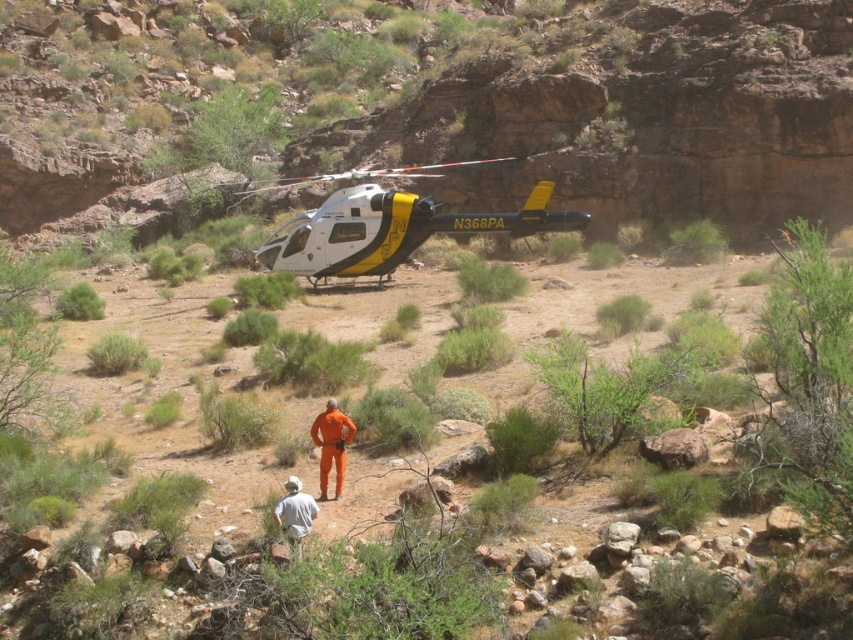
Question: Among these points, which one is nearest to the camera?

Choices:
 (A) (292, 483)
 (B) (699, 115)
 (C) (541, 198)
 (D) (331, 397)

Answer: (A)

Question: Is rustic stone cliff at center in front of white fabric shirt at lower center?

Choices:
 (A) yes
 (B) no

Answer: (B)

Question: Which object is closer to the camera taking this photo?

Choices:
 (A) orange jumpsuit at center
 (B) white glossy helicopter at center

Answer: (A)

Question: Is rustic stone cliff at center smaller than orange jumpsuit at center?

Choices:
 (A) no
 (B) yes

Answer: (A)

Question: Is rustic stone cliff at center thinner than white glossy helicopter at center?

Choices:
 (A) yes
 (B) no

Answer: (B)

Question: Among these points, which one is nearest to the camera?

Choices:
 (A) (339, 436)
 (B) (546, 218)
 (C) (300, 508)
 (D) (604, 209)

Answer: (C)